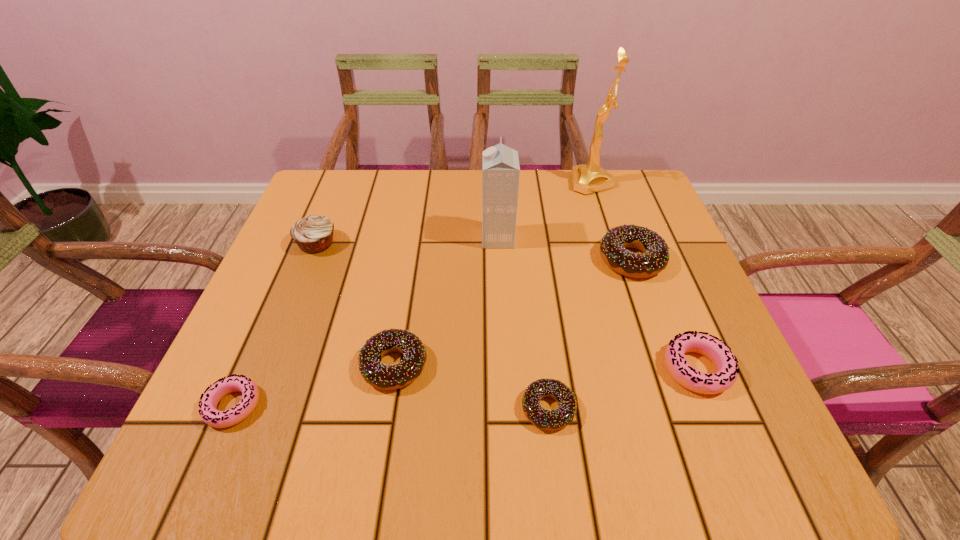
Identify the location of object situated at the far right corner. The width and height of the screenshot is (960, 540). (589, 178).

In the image, there is a desktop. Identify the location of free space at the far edge. (518, 222).

The image size is (960, 540). What are the coordinates of `blank space at the near edge` in the screenshot? It's located at (549, 449).

The image size is (960, 540). What are the coordinates of `vacant region at the left edge of the desktop` in the screenshot? It's located at (326, 251).

Find the location of `vacant space at the right edge of the desktop`. vacant space at the right edge of the desktop is located at coordinates (671, 323).

Locate an element on the screen. vacant space at the far left corner of the desktop is located at coordinates (325, 188).

The width and height of the screenshot is (960, 540). What are the coordinates of `vacant space at the far right corner of the desktop` in the screenshot? It's located at (597, 206).

Locate an element on the screen. This screenshot has height=540, width=960. vacant area between the second tallest object and the rightmost chocolate doughnut is located at coordinates (564, 249).

Identify the location of free space between the left pink doughnut and the seventh shortest object. click(366, 322).

At what (x,y) coordinates should I click in order to perform the action: click on vacant space in between the leftmost chocolate doughnut and the left pink doughnut. Please return your answer as a coordinate pair (x, y). The image size is (960, 540). Looking at the image, I should click on (314, 386).